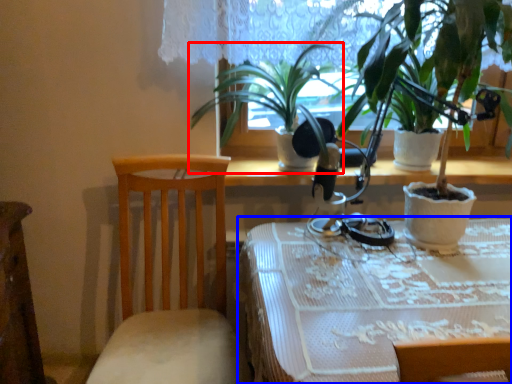
Question: Which object appears farthest to the camera in this image, houseplant (highlighted by a red box) or table (highlighted by a blue box)?

Choices:
 (A) houseplant
 (B) table

Answer: (A)